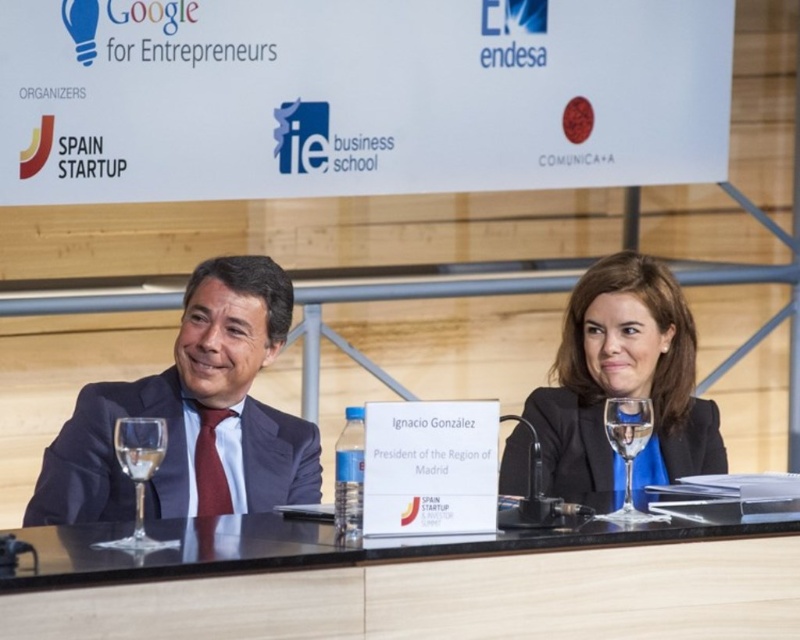
Question: Which point appears closest to the camera in this image?

Choices:
 (A) coord(676,356)
 (B) coord(208,464)

Answer: (B)

Question: Which object appears farthest from the camera in this image?

Choices:
 (A) black matte business suit at center
 (B) dark blue suit at left

Answer: (B)

Question: Does black glossy suit at center have a smaller size compared to black matte business suit at center?

Choices:
 (A) yes
 (B) no

Answer: (B)

Question: Which point is farther to the camera?

Choices:
 (A) (582, 547)
 (B) (140, 483)
 (C) (560, 420)

Answer: (C)

Question: Can you confirm if dark blue suit at left is wider than black glossy suit at center?

Choices:
 (A) yes
 (B) no

Answer: (A)

Question: Is dark blue suit at left closer to the viewer compared to clear glass wine glass at left?

Choices:
 (A) yes
 (B) no

Answer: (B)